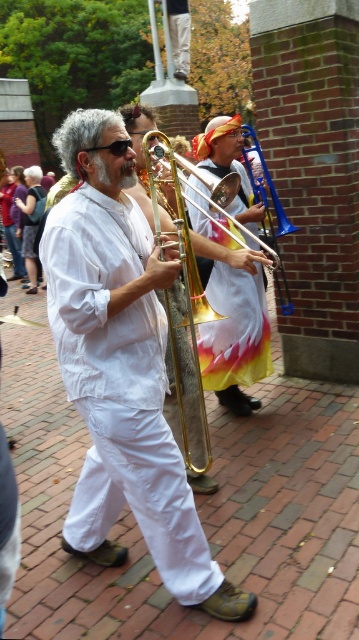
Question: Which point appears closest to the camera in this image?

Choices:
 (A) (227, 221)
 (B) (193, 282)
 (C) (159, 454)

Answer: (C)

Question: Does white linen robe at center appear on the right side of metallic gold trombone at center?

Choices:
 (A) yes
 (B) no

Answer: (B)

Question: Which of the following is the closest to the observer?

Choices:
 (A) (188, 269)
 (B) (114, 285)

Answer: (B)

Question: Estimate the real-world distances between objects in this image. Which object is closer to the gold brass trombone at center?

Choices:
 (A) white linen robe at center
 (B) metallic gold trombone at center

Answer: (A)

Question: Is the position of white linen robe at center more distant than that of gold brass trombone at center?

Choices:
 (A) no
 (B) yes

Answer: (A)

Question: Can you confirm if white linen robe at center is smaller than gold brass trombone at center?

Choices:
 (A) no
 (B) yes

Answer: (A)